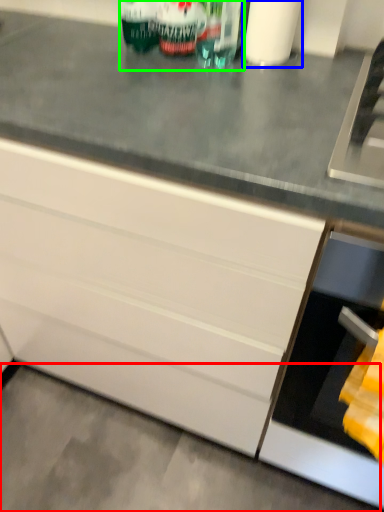
Question: Which is farther away from concrete (highlighted by a red box)? toilet paper (highlighted by a blue box) or beverage (highlighted by a green box)?

Choices:
 (A) toilet paper
 (B) beverage

Answer: (A)